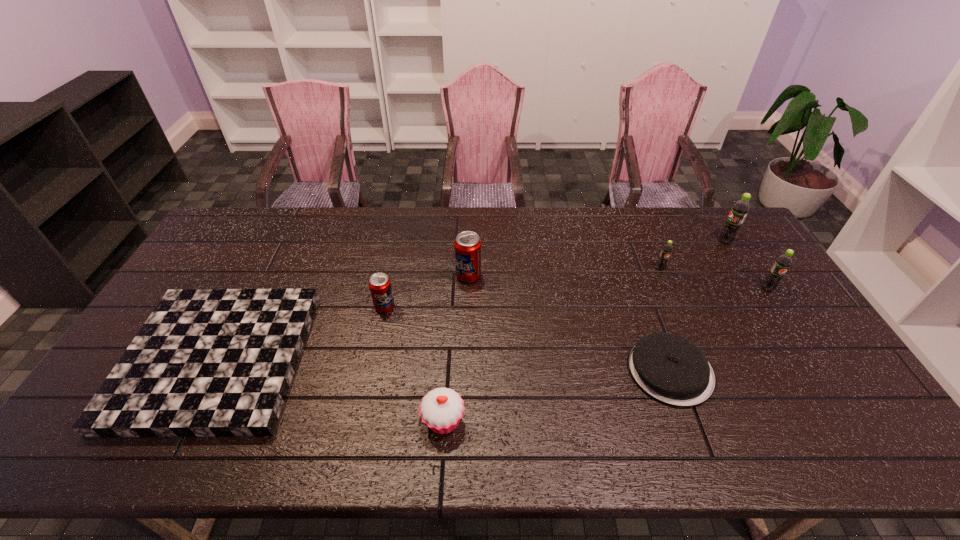
Find the location of a particular element. Image resolution: width=960 pixels, height=540 pixels. the second shortest object is located at coordinates pos(671,369).

Identify the location of the leftmost object. This screenshot has width=960, height=540. (207, 362).

Image resolution: width=960 pixels, height=540 pixels. In order to click on the shortest object in this screenshot , I will do (207, 362).

Where is `vacant position located on the front label of the farthest green soda`? vacant position located on the front label of the farthest green soda is located at coordinates (615, 241).

This screenshot has width=960, height=540. I want to click on vacant space located on the front label of the farthest green soda, so click(x=653, y=241).

You are a GUI agent. You are given a task and a screenshot of the screen. Output one action in this format:
    pyautogui.click(x=<x>, y=<y>)
    Task: Click on the vacant area situated on the front label of the farthest green soda
    This screenshot has width=960, height=540.
    Given the screenshot: What is the action you would take?
    pyautogui.click(x=630, y=241)

Where is `free location located on the front label of the nearest green soda`? Image resolution: width=960 pixels, height=540 pixels. free location located on the front label of the nearest green soda is located at coordinates (819, 366).

In order to click on free space located on the back of the farther red soda can in this screenshot , I will do `click(469, 237)`.

Locate an element on the screen. free location located on the back of the seventh object from right to left is located at coordinates (397, 247).

The image size is (960, 540). Identify the location of free space located on the front label of the leftmost green soda. (685, 327).